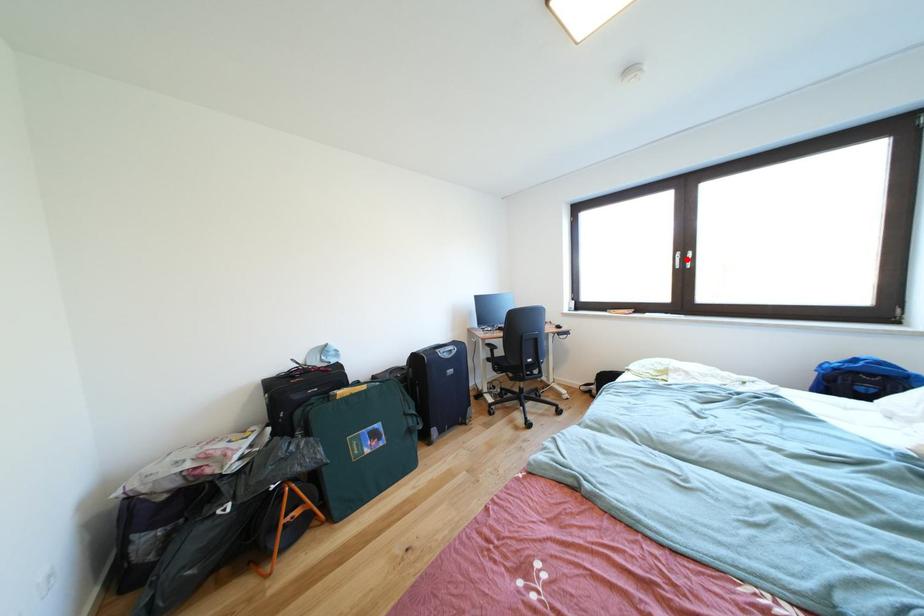
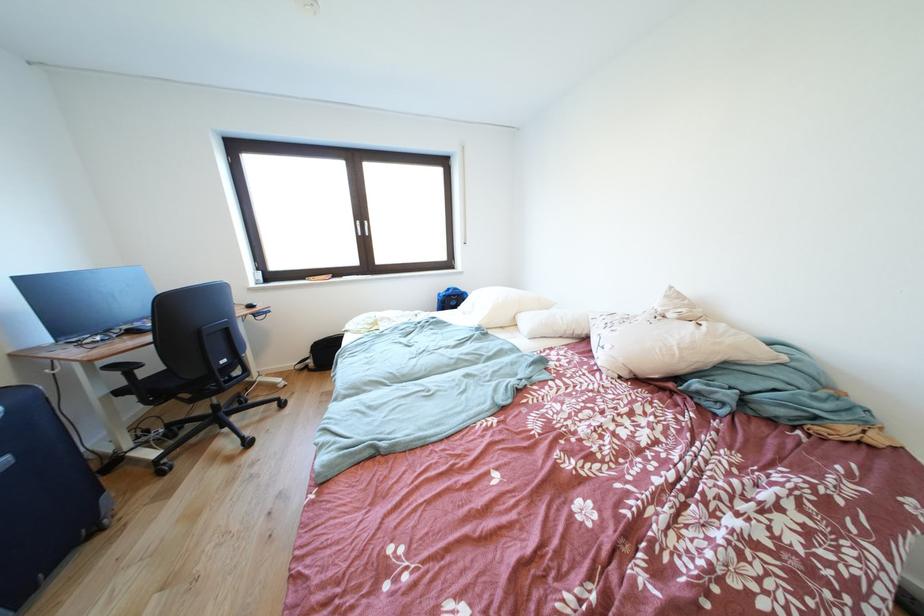
Find the pixel in the second image that matches the highlighted location in the first image.

(367, 228)